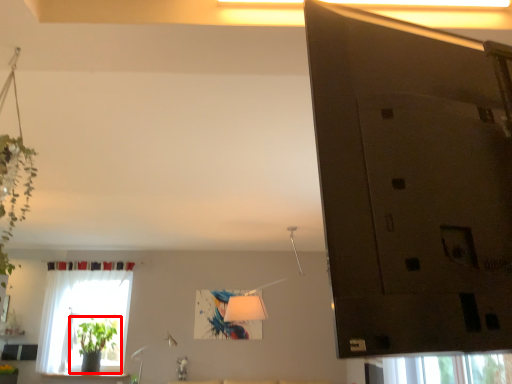
Question: Observing the image, what is the correct spatial positioning of houseplant (annotated by the red box) in reference to window?

Choices:
 (A) right
 (B) left

Answer: (A)